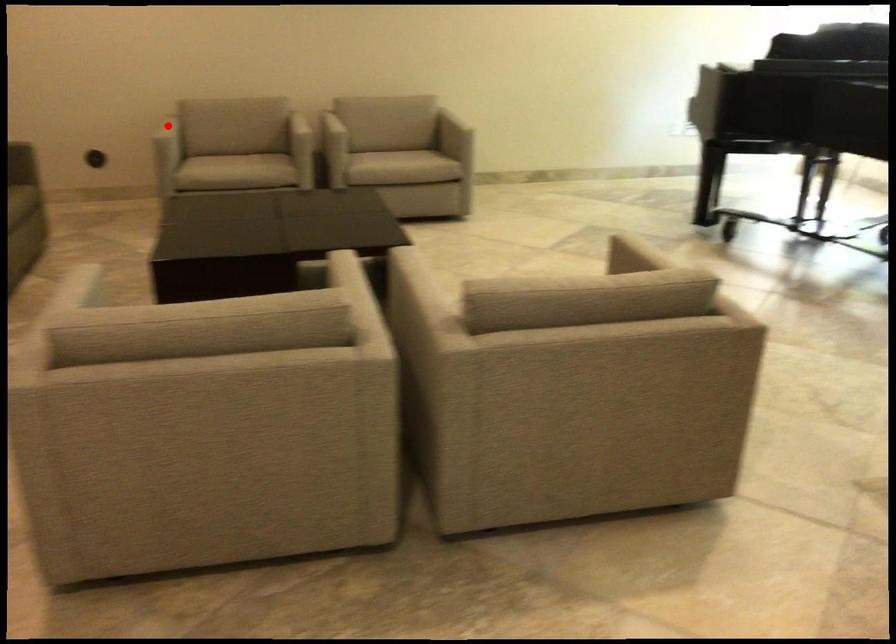
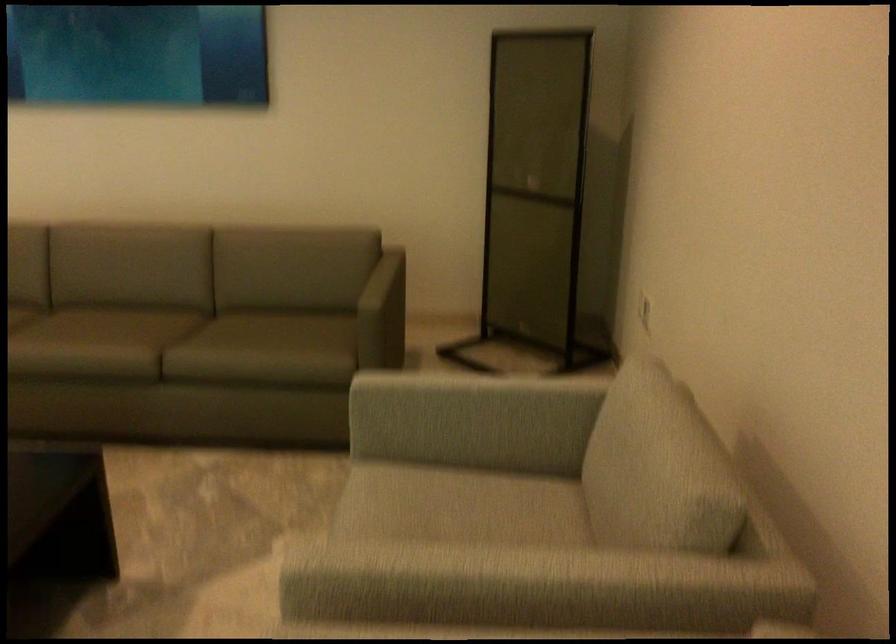
Question: I am providing you with two images of the same scene from different viewpoints. A red point is shown in image1. For the corresponding object point in image2, is it positioned nearer or farther from the camera?

Choices:
 (A) Nearer
 (B) Farther

Answer: (A)